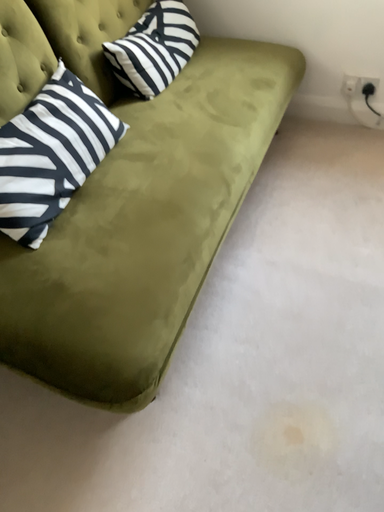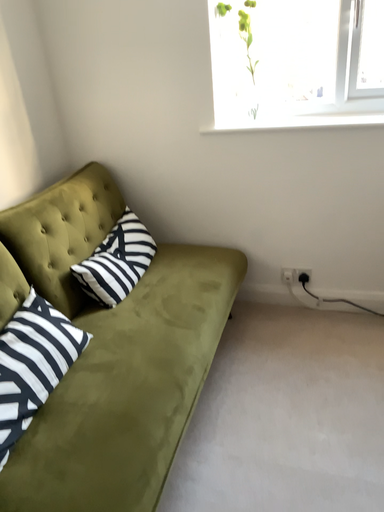
Question: How did the camera likely rotate when shooting the video?

Choices:
 (A) rotated downward
 (B) rotated upward

Answer: (B)